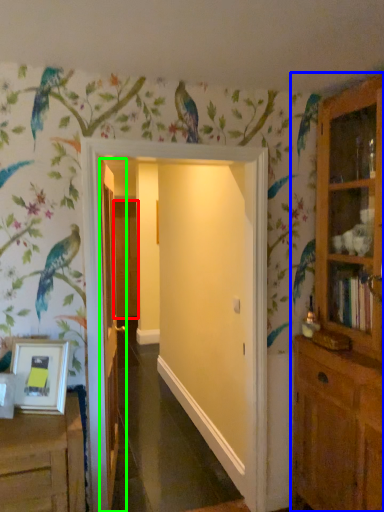
Question: Which object is positioned closest to door (highlighted by a red box)? Select from cupboard (highlighted by a blue box) and door (highlighted by a green box).

Choices:
 (A) cupboard
 (B) door

Answer: (B)